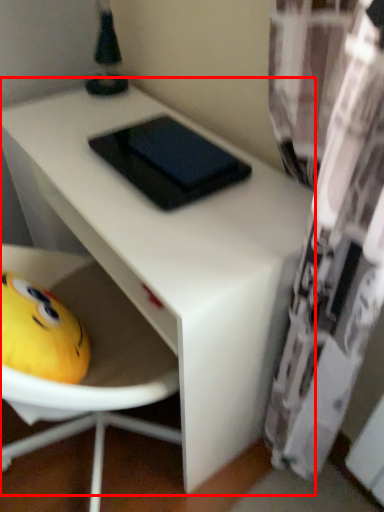
Question: Observing the image, what is the correct spatial positioning of table (annotated by the red box) in reference to pad?

Choices:
 (A) right
 (B) left

Answer: (B)